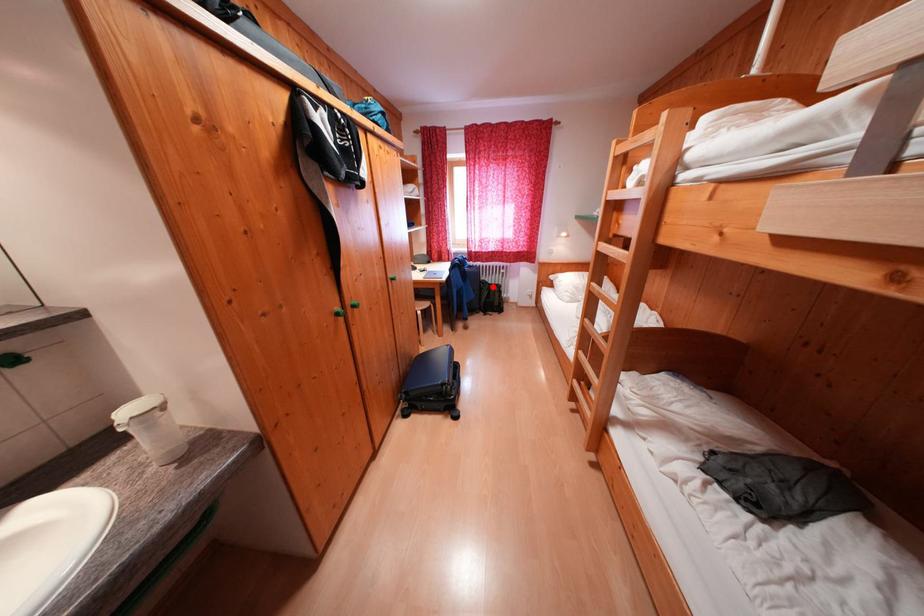
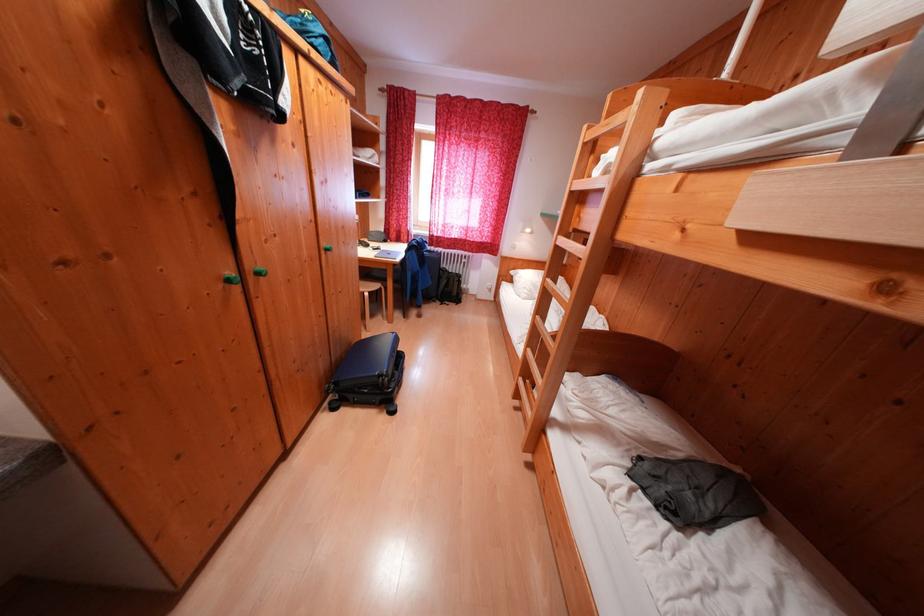
Question: I am providing you with two images of the same scene from different viewpoints. Given a red point in image1, look at the same physical point in image2. Is it:

Choices:
 (A) Closer to the viewpoint
 (B) Farther from the viewpoint

Answer: (A)